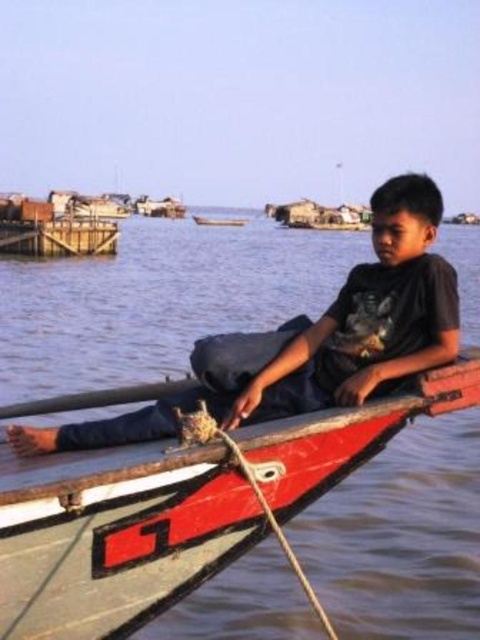
Can you confirm if wooden canoe at center is thinner than smooth wood boat at center?

Indeed, wooden canoe at center has a lesser width compared to smooth wood boat at center.

Does wooden canoe at center come behind smooth wood boat at center?

That is False.

Is point (241, 442) positioned in front of point (227, 224)?

Yes, point (241, 442) is closer to viewer.

Locate an element on the screen. The image size is (480, 640). wooden canoe at center is located at coordinates (116, 536).

Is matte black shirt at center further to camera compared to smooth wood boat at center?

No, matte black shirt at center is in front of smooth wood boat at center.

Is the position of matte black shirt at center less distant than that of smooth wood boat at center?

Yes.

The width and height of the screenshot is (480, 640). What do you see at coordinates (312, 339) in the screenshot?
I see `matte black shirt at center` at bounding box center [312, 339].

Locate an element on the screen. The height and width of the screenshot is (640, 480). matte black shirt at center is located at coordinates click(x=312, y=339).

Who is more forward, (432,404) or (415,189)?

Point (432,404) is in front.

Between wooden canoe at center and matte black shirt at center, which one has less height?

With less height is wooden canoe at center.

Describe the element at coordinates (116, 536) in the screenshot. Image resolution: width=480 pixels, height=640 pixels. I see `wooden canoe at center` at that location.

Where is `wooden canoe at center`? The image size is (480, 640). wooden canoe at center is located at coordinates (116, 536).